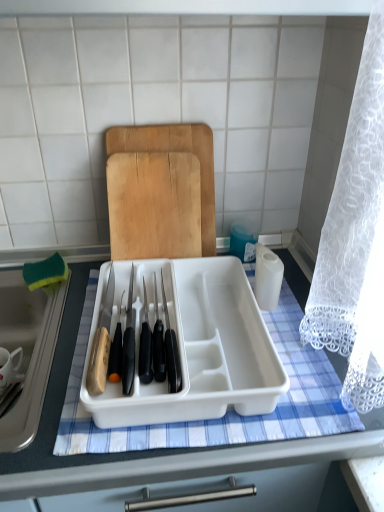
Question: Is wooden cutting board at center bigger or smaller than green sponge at left?

Choices:
 (A) big
 (B) small

Answer: (B)

Question: Choose the correct answer: Is wooden cutting board at center inside green sponge at left or outside it?

Choices:
 (A) outside
 (B) inside

Answer: (A)

Question: Which object is the farthest from the white plastic tray at center?

Choices:
 (A) green sponge at left
 (B) wooden cutting board at center
 (C) white plastic tray at center

Answer: (B)

Question: Which object is positioned farthest from the wooden cutting board at center?

Choices:
 (A) green sponge at left
 (B) white plastic tray at center
 (C) white plastic tray at center

Answer: (B)